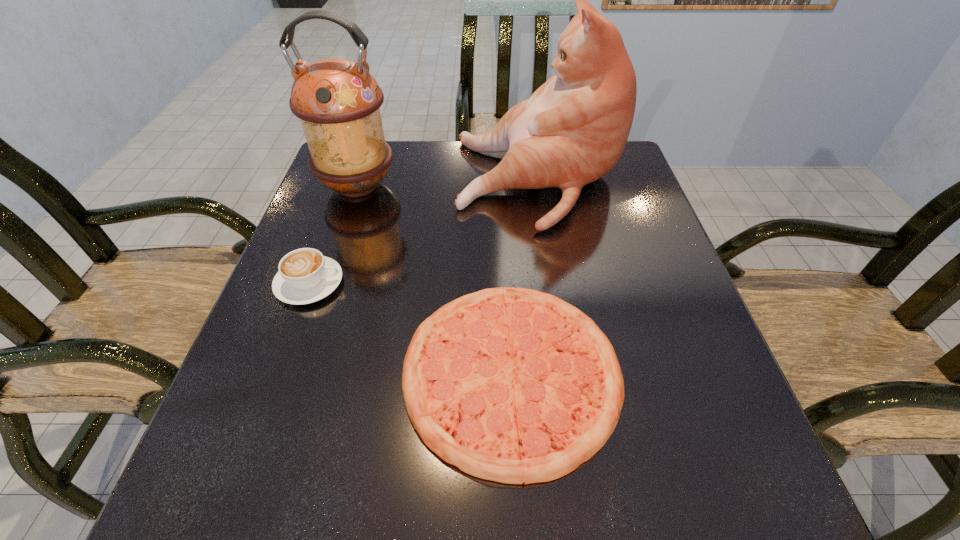
The height and width of the screenshot is (540, 960). Identify the location of free region that satisfies the following two spatial constraints: 1. on the side of the cappuccino with the handle; 2. on the back side of the shortest object. (276, 372).